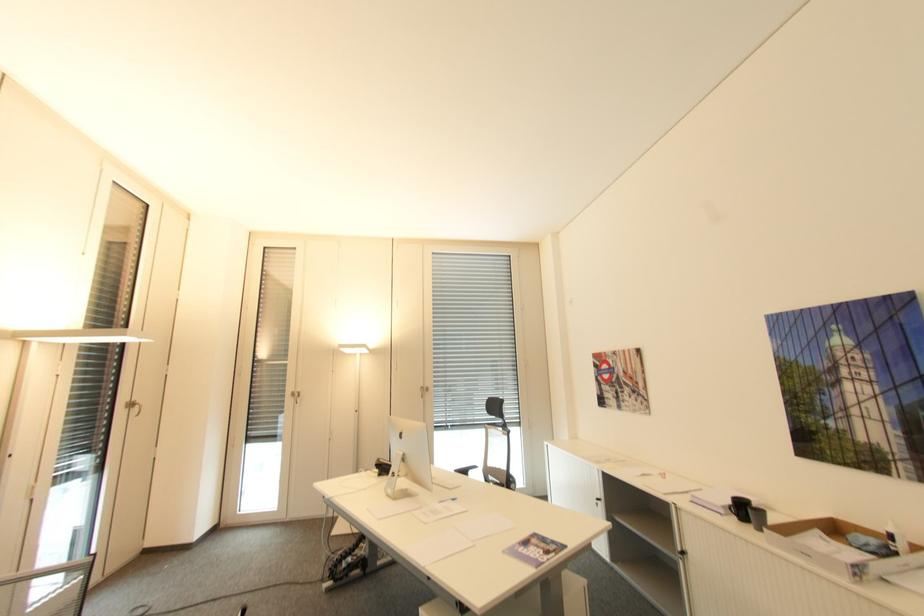
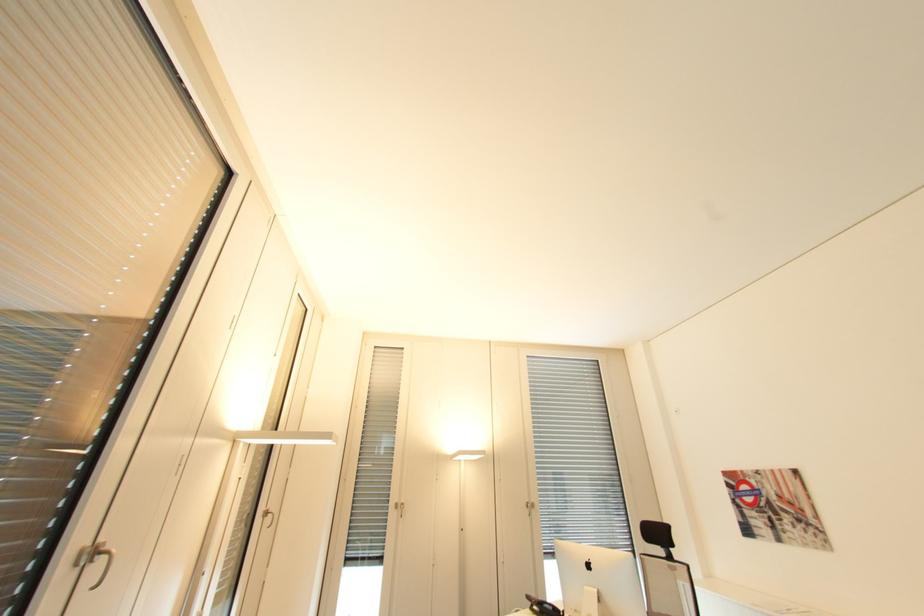
Question: In a continuous first-person perspective shot, in which direction is the camera moving?

Choices:
 (A) Left
 (B) Right
 (C) Forward
 (D) Backward

Answer: (A)